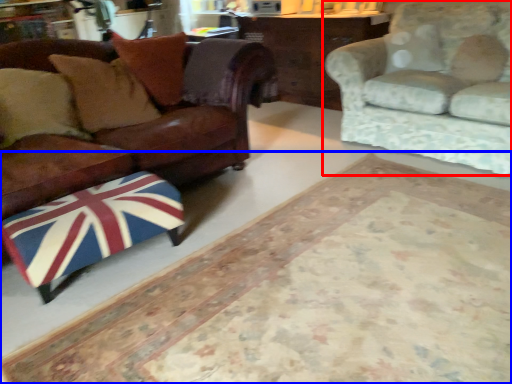
Question: Which object is closer to the camera taking this photo, studio couch (highlighted by a red box) or mat (highlighted by a blue box)?

Choices:
 (A) studio couch
 (B) mat

Answer: (B)